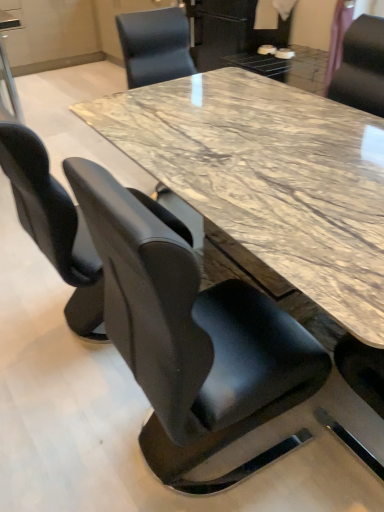
Identify the location of black leather chair at center, which is the 2th chair from right to left. (189, 330).

Is black leather chair at center, the 2th chair from the left, inside or outside of black leather chair at left, which appears as the 3th chair when viewed from the right?

black leather chair at center, the 2th chair from the left, is not inside black leather chair at left, which appears as the 3th chair when viewed from the right, it's outside.

From the picture: From the image's perspective, which one is positioned lower, black leather chair at center, the third chair from the back, or black leather chair at left, which appears as the 3th chair when viewed from the right?

black leather chair at center, the third chair from the back, from the image's perspective.

Is black leather chair at upper right, positioned as the 3th chair in front-to-back order, oriented towards black leather chair at center, the third chair from the back?

No, black leather chair at upper right, positioned as the 3th chair in front-to-back order, is not facing towards black leather chair at center, the third chair from the back.

Can you confirm if black leather chair at upper right, which appears as the third chair when viewed from the left, is smaller than black leather chair at center, which is the 2th chair from right to left?

Yes, black leather chair at upper right, which appears as the third chair when viewed from the left, is smaller than black leather chair at center, which is the 2th chair from right to left.

Is black leather chair at upper right, positioned as the 3th chair in front-to-back order, in front of or behind black leather chair at center, the third chair from the back, in the image?

black leather chair at upper right, positioned as the 3th chair in front-to-back order, is positioned farther from the viewer than black leather chair at center, the third chair from the back.

Would you say black leather chair at upper right, positioned as the 3th chair in front-to-back order, is inside or outside black leather chair at center, which is the 2th chair from right to left?

black leather chair at upper right, positioned as the 3th chair in front-to-back order, is located beyond the bounds of black leather chair at center, which is the 2th chair from right to left.

Is black leather chair at left, which appears as the 3th chair when viewed from the right, oriented away from black leather chair at upper right, the first chair when ordered from back to front?

That's not correct — black leather chair at left, which appears as the 3th chair when viewed from the right, is not looking away from black leather chair at upper right, the first chair when ordered from back to front.

Consider the image. Is black leather chair at left, which appears as the 1th chair when viewed from the left, far from black leather chair at upper right, positioned as the 3th chair in front-to-back order?

black leather chair at left, which appears as the 1th chair when viewed from the left, is far away from black leather chair at upper right, positioned as the 3th chair in front-to-back order.

Is point (189, 237) closer to camera compared to point (382, 60)?

Yes, it is.

From the black leather chair at upper right, positioned as the 3th chair in front-to-back order, count the 2nd chair to the left and point to it. Please provide its 2D coordinates.

[(54, 226)]

How many degrees apart are the facing directions of black leather chair at upper right, the first chair when ordered from back to front, and black leather chair at left, which appears as the 3th chair when viewed from the right?

They differ by 176 degrees in their facing directions.

Which of these two, black leather chair at upper right, acting as the 1th chair starting from the right, or black leather chair at left, which appears as the 1th chair when viewed from the left, is thinner?

With smaller width is black leather chair at upper right, acting as the 1th chair starting from the right.

Starting from the black leather chair at upper right, positioned as the 3th chair in front-to-back order, which chair is the 2nd one to the left? Please provide its 2D coordinates.

[(54, 226)]

Is black leather chair at upper right, acting as the 1th chair starting from the right, looking in the opposite direction of black leather chair at left, which is the 2th chair in front-to-back order?

No.

Which is nearer, [241,307] or [334,97]?

The point [241,307] is closer to the camera.

Measure the distance between black leather chair at center, the 1th chair when ordered from front to back, and black leather chair at upper right, which appears as the third chair when viewed from the left.

black leather chair at center, the 1th chair when ordered from front to back, and black leather chair at upper right, which appears as the third chair when viewed from the left, are 1.37 meters apart.

Could you tell me if black leather chair at center, the third chair from the back, is facing black leather chair at upper right, the first chair when ordered from back to front?

No, black leather chair at center, the third chair from the back, is not aimed at black leather chair at upper right, the first chair when ordered from back to front.

From the picture: From the image's perspective, relative to black leather chair at upper right, the first chair when ordered from back to front, is black leather chair at center, the 1th chair when ordered from front to back, above or below?

Based on their image positions, black leather chair at center, the 1th chair when ordered from front to back, is located beneath black leather chair at upper right, the first chair when ordered from back to front.

Is black leather chair at left, which appears as the 1th chair when viewed from the left, in front of black leather chair at center, which is the 2th chair from right to left?

That is False.

Considering the sizes of objects black leather chair at left, which appears as the 3th chair when viewed from the right, and black leather chair at center, which is the 2th chair from right to left, in the image provided, who is bigger, black leather chair at left, which appears as the 3th chair when viewed from the right, or black leather chair at center, which is the 2th chair from right to left,?

black leather chair at left, which appears as the 3th chair when viewed from the right.

Is black leather chair at left, which appears as the 1th chair when viewed from the left, not inside black leather chair at center, which is the 2th chair from right to left?

Indeed, black leather chair at left, which appears as the 1th chair when viewed from the left, is completely outside black leather chair at center, which is the 2th chair from right to left.

Does black leather chair at left, which appears as the 3th chair when viewed from the right, turn towards black leather chair at center, the 1th chair when ordered from front to back?

No, black leather chair at left, which appears as the 3th chair when viewed from the right, does not turn towards black leather chair at center, the 1th chair when ordered from front to back.

At what (x,y) coordinates should I click in order to perform the action: click on chair in front of the black leather chair at left, which ranks as the 2th chair in back-to-front order. Please return your answer as a coordinate pair (x, y). Image resolution: width=384 pixels, height=512 pixels. Looking at the image, I should click on (189, 330).

Which chair is the 2nd one when counting from the back of the black leather chair at center, which is the 2th chair from right to left? Please provide its 2D coordinates.

[(361, 67)]

Consider the image. Which object lies further to the anchor point black leather chair at left, which ranks as the 2th chair in back-to-front order, black leather chair at center, which is the 2th chair from right to left, or black leather chair at upper right, positioned as the 3th chair in front-to-back order?

black leather chair at upper right, positioned as the 3th chair in front-to-back order, is further to black leather chair at left, which ranks as the 2th chair in back-to-front order.

Looking at the image, which one is located closer to black leather chair at center, the 1th chair when ordered from front to back, black leather chair at upper right, positioned as the 3th chair in front-to-back order, or black leather chair at left, which ranks as the 2th chair in back-to-front order?

black leather chair at left, which ranks as the 2th chair in back-to-front order.

Looking at the image, which one is located further to black leather chair at upper right, acting as the 1th chair starting from the right, black leather chair at left, which appears as the 3th chair when viewed from the right, or black leather chair at center, the 1th chair when ordered from front to back?

The object further to black leather chair at upper right, acting as the 1th chair starting from the right, is black leather chair at center, the 1th chair when ordered from front to back.

Looking at this image, considering their positions, is black leather chair at left, which appears as the 1th chair when viewed from the left, positioned closer to black leather chair at center, the third chair from the back, than black leather chair at upper right, acting as the 1th chair starting from the right?

black leather chair at left, which appears as the 1th chair when viewed from the left, is positioned closer to the anchor black leather chair at center, the third chair from the back.

Which object lies further to the anchor point black leather chair at upper right, acting as the 1th chair starting from the right, black leather chair at center, the 1th chair when ordered from front to back, or black leather chair at left, which is the 2th chair in front-to-back order?

black leather chair at center, the 1th chair when ordered from front to back, is positioned further to the anchor black leather chair at upper right, acting as the 1th chair starting from the right.

When comparing their distances from black leather chair at left, which appears as the 1th chair when viewed from the left, does black leather chair at upper right, positioned as the 3th chair in front-to-back order, or black leather chair at center, the third chair from the back, seem further?

black leather chair at upper right, positioned as the 3th chair in front-to-back order, is positioned further to the anchor black leather chair at left, which appears as the 1th chair when viewed from the left.

Identify the location of chair located between black leather chair at center, the third chair from the back, and black leather chair at upper right, the first chair when ordered from back to front, in the depth direction. This screenshot has width=384, height=512. (54, 226).